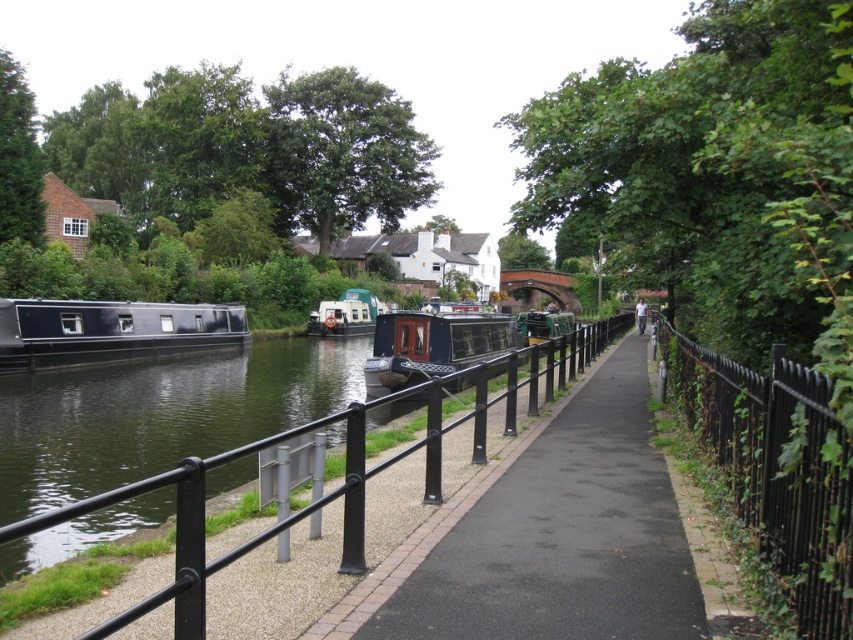
Question: In this image, where is black asphalt pavement at center located relative to white plastic boat at center?

Choices:
 (A) above
 (B) below

Answer: (B)

Question: Which object is farther from the camera taking this photo?

Choices:
 (A) black metal/rail at center
 (B) matte black barge at center
 (C) black asphalt pavement at center
 (D) black wrought iron fence at right

Answer: (B)

Question: Which object is the farthest from the black wrought iron fence at right?

Choices:
 (A) matte black barge at left
 (B) black asphalt pavement at center
 (C) matte black barge at center

Answer: (A)

Question: In this image, where is black asphalt pavement at center located relative to matte black barge at center?

Choices:
 (A) left
 (B) right

Answer: (B)

Question: Which object appears farthest from the camera in this image?

Choices:
 (A) white plastic boat at center
 (B) black metal/rail at center
 (C) matte black barge at center

Answer: (A)

Question: Is matte black barge at left positioned at the back of white plastic boat at center?

Choices:
 (A) no
 (B) yes

Answer: (A)